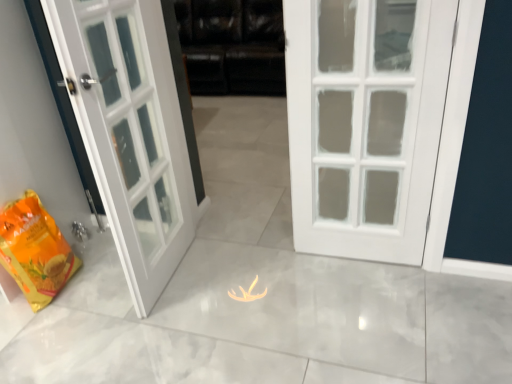
This screenshot has height=384, width=512. What do you see at coordinates (233, 46) in the screenshot?
I see `black leather couch at center` at bounding box center [233, 46].

Locate an element on the screen. The width and height of the screenshot is (512, 384). black leather couch at center is located at coordinates (233, 46).

In order to face black leather couch at center, should I rotate leftwards or rightwards?

To align with it, rotate left about 3.506°.

The image size is (512, 384). In order to click on yellow matte shopping bag at lower left in this screenshot , I will do `click(35, 250)`.

What is the approximate height of yellow matte shopping bag at lower left?

17.86 inches.

What do you see at coordinates (35, 250) in the screenshot?
I see `yellow matte shopping bag at lower left` at bounding box center [35, 250].

This screenshot has height=384, width=512. What are the coordinates of `black leather couch at center` in the screenshot? It's located at (233, 46).

Can you confirm if black leather couch at center is positioned to the left of yellow matte shopping bag at lower left?

No.

In the scene shown: Is black leather couch at center positioned before yellow matte shopping bag at lower left?

No, the depth of black leather couch at center is greater than that of yellow matte shopping bag at lower left.

Is point (228, 25) closer or farther from the camera than point (58, 280)?

Point (228, 25) is positioned farther from the camera compared to point (58, 280).

From the image's perspective, is black leather couch at center over yellow matte shopping bag at lower left?

Yes, from the image's perspective, black leather couch at center is on top of yellow matte shopping bag at lower left.

From a real-world perspective, does black leather couch at center stand above yellow matte shopping bag at lower left?

Yes, from a real-world perspective, black leather couch at center is above yellow matte shopping bag at lower left.

Which of these two, black leather couch at center or yellow matte shopping bag at lower left, is thinner?

With smaller width is yellow matte shopping bag at lower left.

Is black leather couch at center taller or shorter than yellow matte shopping bag at lower left?

black leather couch at center is taller than yellow matte shopping bag at lower left.

Considering the sizes of objects black leather couch at center and yellow matte shopping bag at lower left in the image provided, who is smaller, black leather couch at center or yellow matte shopping bag at lower left?

yellow matte shopping bag at lower left.

Would you say yellow matte shopping bag at lower left is part of black leather couch at center's contents?

No, black leather couch at center does not contain yellow matte shopping bag at lower left.

Is there a large distance between black leather couch at center and yellow matte shopping bag at lower left?

black leather couch at center is far away from yellow matte shopping bag at lower left.

Is black leather couch at center oriented towards yellow matte shopping bag at lower left?

Yes, black leather couch at center is aimed at yellow matte shopping bag at lower left.

Measure the distance from black leather couch at center to yellow matte shopping bag at lower left.

black leather couch at center is 2.86 meters from yellow matte shopping bag at lower left.

You are a GUI agent. You are given a task and a screenshot of the screen. Output one action in this format:
    pyautogui.click(x=<x>, y=<y>)
    Task: Click on the dark behind the yellow matte shopping bag at lower left
    The height and width of the screenshot is (384, 512).
    Given the screenshot: What is the action you would take?
    pyautogui.click(x=233, y=46)

Is yellow matte shopping bag at lower left to the left or to the right of black leather couch at center in the image?

In the image, yellow matte shopping bag at lower left appears on the left side of black leather couch at center.

Between yellow matte shopping bag at lower left and black leather couch at center, which one is positioned behind?

black leather couch at center is further away from the camera.

Is point (19, 224) less distant than point (277, 80)?

Yes, point (19, 224) is closer to viewer.

From the image's perspective, relative to black leather couch at center, is yellow matte shopping bag at lower left above or below?

From the image's perspective, yellow matte shopping bag at lower left appears below black leather couch at center.

From a real-world perspective, is yellow matte shopping bag at lower left positioned under black leather couch at center based on gravity?

Yes.

Based on the photo, does yellow matte shopping bag at lower left have a lesser width compared to black leather couch at center?

Correct, the width of yellow matte shopping bag at lower left is less than that of black leather couch at center.

Considering the sizes of objects yellow matte shopping bag at lower left and black leather couch at center in the image provided, who is shorter, yellow matte shopping bag at lower left or black leather couch at center?

yellow matte shopping bag at lower left is shorter.

Which of these two, yellow matte shopping bag at lower left or black leather couch at center, is smaller?

With smaller size is yellow matte shopping bag at lower left.

Is yellow matte shopping bag at lower left completely or partially outside of black leather couch at center?

That's correct, yellow matte shopping bag at lower left is outside of black leather couch at center.

Would you say yellow matte shopping bag at lower left is a long distance from black leather couch at center?

Indeed, yellow matte shopping bag at lower left is not near black leather couch at center.

In the scene shown: Is yellow matte shopping bag at lower left facing towards black leather couch at center?

No, yellow matte shopping bag at lower left is not turned towards black leather couch at center.

Measure the distance from yellow matte shopping bag at lower left to black leather couch at center.

yellow matte shopping bag at lower left and black leather couch at center are 9.37 feet apart from each other.

I want to click on shopping bag on the left of the black leather couch at center, so click(35, 250).

Identify the location of dark to the right of yellow matte shopping bag at lower left. (233, 46).

I want to click on dark that appears above the yellow matte shopping bag at lower left (from a real-world perspective), so click(233, 46).